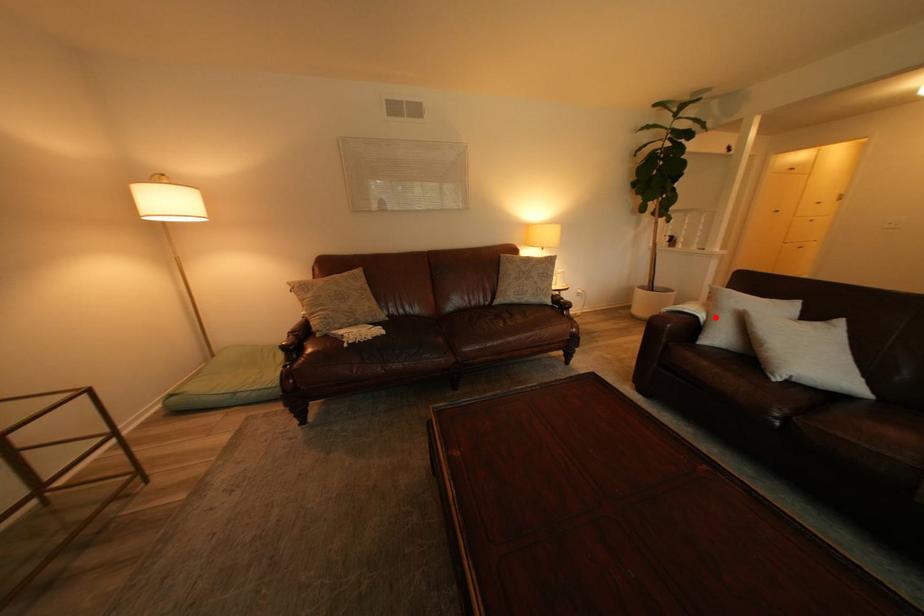
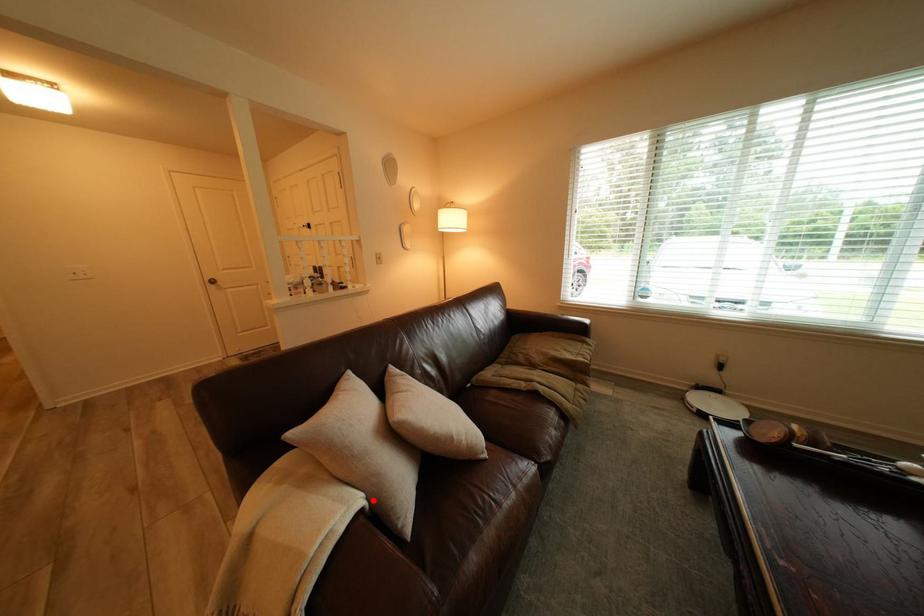
I am providing you with two images of the same scene from different viewpoints. A red point is marked on the first image and another point is marked on the second image. Is the marked point in image1 the same physical position as the marked point in image2?

Yes